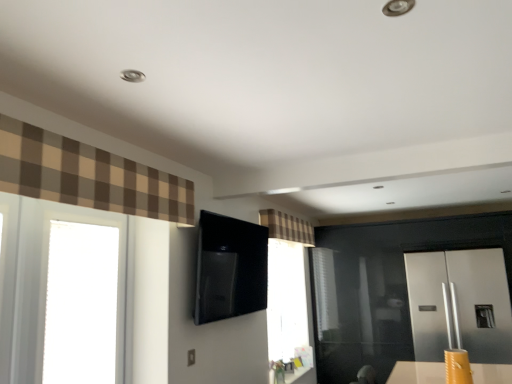
Question: Is matte black outlet at lower center at the right side of plaid fabric curtain at upper center, acting as the second curtain starting from the top?

Choices:
 (A) yes
 (B) no

Answer: (B)

Question: Does matte black outlet at lower center have a smaller size compared to plaid fabric curtain at upper center, acting as the second curtain starting from the top?

Choices:
 (A) no
 (B) yes

Answer: (B)

Question: Is the position of matte black outlet at lower center more distant than that of plaid fabric curtain at upper center, acting as the second curtain starting from the top?

Choices:
 (A) yes
 (B) no

Answer: (B)

Question: From a real-world perspective, is matte black outlet at lower center below plaid fabric curtain at upper center, which ranks as the first curtain in back-to-front order?

Choices:
 (A) no
 (B) yes

Answer: (B)

Question: Is matte black outlet at lower center positioned far away from plaid fabric curtain at upper center, the second curtain positioned from the left?

Choices:
 (A) yes
 (B) no

Answer: (A)

Question: Considering the positions of brown plaid curtain at upper left, which is the 2th curtain in right-to-left order, and transparent glass window at left in the image, is brown plaid curtain at upper left, which is the 2th curtain in right-to-left order, wider or thinner than transparent glass window at left?

Choices:
 (A) wide
 (B) thin

Answer: (A)

Question: From a real-world perspective, relative to transparent glass window at left, is brown plaid curtain at upper left, which is the 2th curtain in right-to-left order, vertically above or below?

Choices:
 (A) below
 (B) above

Answer: (B)

Question: Do you think brown plaid curtain at upper left, which ranks as the second curtain in bottom-to-top order, is within transparent glass window at left, or outside of it?

Choices:
 (A) inside
 (B) outside

Answer: (B)

Question: In terms of height, does brown plaid curtain at upper left, which is the second curtain in back-to-front order, look taller or shorter compared to transparent glass window at left?

Choices:
 (A) tall
 (B) short

Answer: (B)

Question: Based on their positions, is matte black outlet at lower center located to the left or right of plaid fabric curtain at upper center, the first curtain in the right-to-left sequence?

Choices:
 (A) right
 (B) left

Answer: (B)

Question: Relative to plaid fabric curtain at upper center, acting as the second curtain starting from the top, is matte black outlet at lower center in front or behind?

Choices:
 (A) front
 (B) behind

Answer: (A)

Question: Is matte black outlet at lower center inside or outside of plaid fabric curtain at upper center, the first curtain in the right-to-left sequence?

Choices:
 (A) outside
 (B) inside

Answer: (A)

Question: From the image's perspective, is matte black outlet at lower center positioned above or below plaid fabric curtain at upper center, the first curtain in the right-to-left sequence?

Choices:
 (A) above
 (B) below

Answer: (B)

Question: Looking at their shapes, would you say brown plaid curtain at upper left, the first curtain viewed from the left, is wider or thinner than plaid fabric curtain at upper center, acting as the second curtain starting from the top?

Choices:
 (A) wide
 (B) thin

Answer: (B)

Question: From the image's perspective, relative to plaid fabric curtain at upper center, the second curtain positioned from the left, is brown plaid curtain at upper left, which is counted as the first curtain, starting from the front, above or below?

Choices:
 (A) above
 (B) below

Answer: (A)